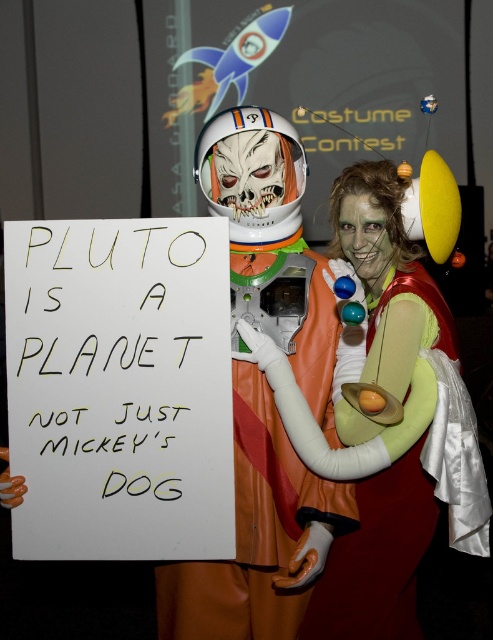
Is green fabric dress at center further to camera compared to orange latex spacesuit at center?

No, it is in front of orange latex spacesuit at center.

Is point (479, 536) closer to camera compared to point (301, 282)?

Yes.

What do you see at coordinates (385, 419) in the screenshot?
I see `green fabric dress at center` at bounding box center [385, 419].

Where is `green fabric dress at center`? The height and width of the screenshot is (640, 493). green fabric dress at center is located at coordinates (385, 419).